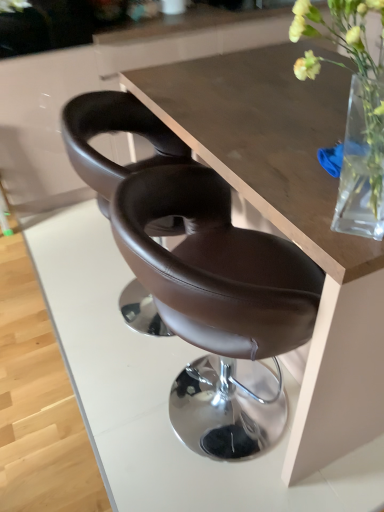
Where is `vacant region in front of brown leather chair at center, positioned as the 1th chair in back-to-front order`? This screenshot has width=384, height=512. vacant region in front of brown leather chair at center, positioned as the 1th chair in back-to-front order is located at coordinates (93, 415).